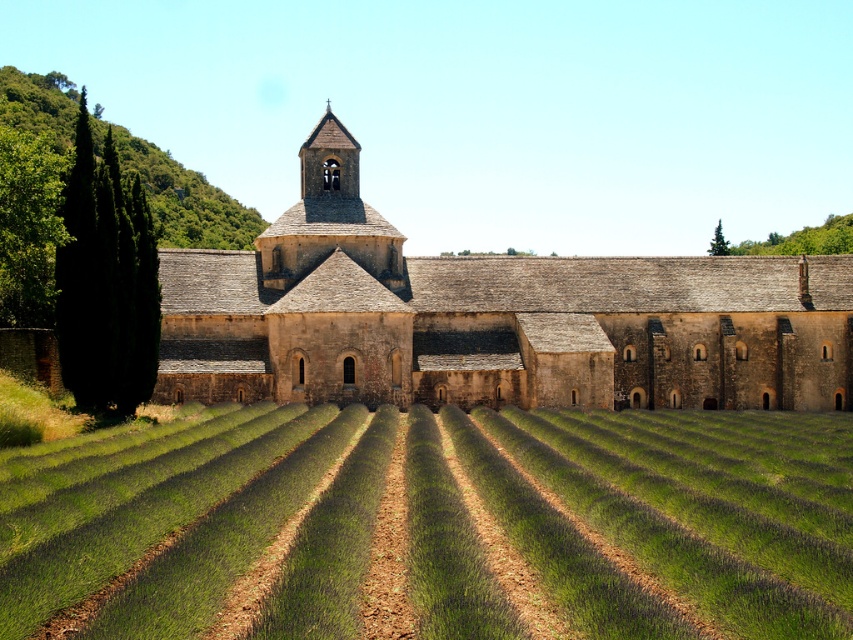
Question: Can you confirm if green grass at center is smaller than brown stone church at center?

Choices:
 (A) no
 (B) yes

Answer: (B)

Question: Which object appears closest to the camera in this image?

Choices:
 (A) green leafy hillside at upper left
 (B) green grass at center
 (C) brown stone church at center

Answer: (B)

Question: Is green grass at center above brown stone church at center?

Choices:
 (A) yes
 (B) no

Answer: (B)

Question: Is green grass at center to the left of brown stone church at center from the viewer's perspective?

Choices:
 (A) yes
 (B) no

Answer: (A)

Question: Which point is farther to the camera?

Choices:
 (A) (285, 445)
 (B) (59, 150)

Answer: (B)

Question: Estimate the real-world distances between objects in this image. Which object is farther from the green leafy hillside at upper left?

Choices:
 (A) green grass at center
 (B) brown stone church at center

Answer: (A)